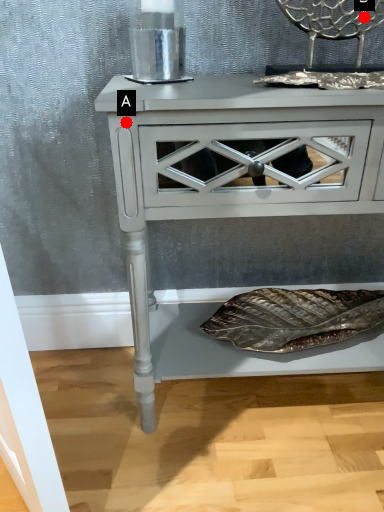
Question: Two points are circled on the image, labeled by A and B beside each circle. Which point appears farthest from the camera in this image?

Choices:
 (A) A is further
 (B) B is further

Answer: (B)